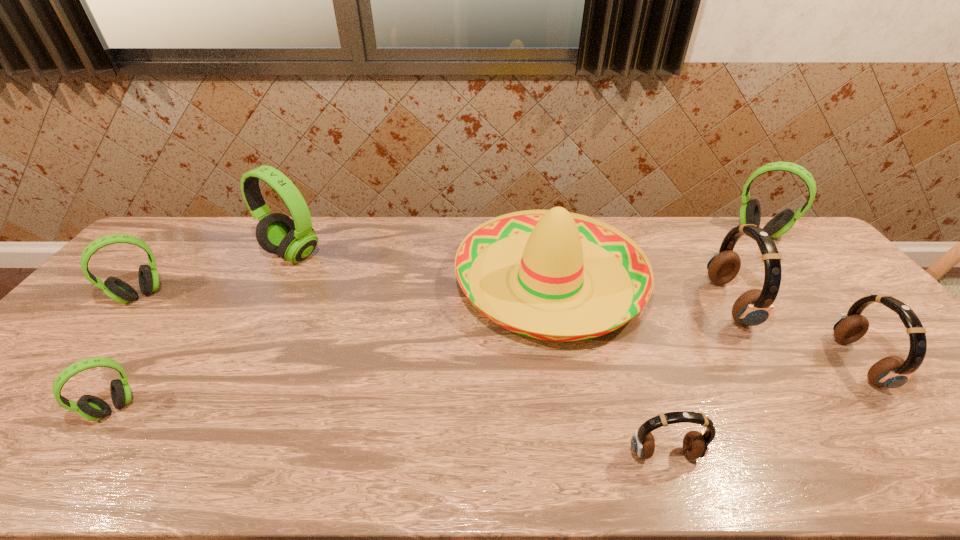
You are a GUI agent. You are given a task and a screenshot of the screen. Output one action in this format:
    pyautogui.click(x=<x>, y=<y>)
    Task: Click on the third green headset from left to right
    The height and width of the screenshot is (540, 960).
    Given the screenshot: What is the action you would take?
    [294, 240]

At what (x,y) coordinates should I click in order to perform the action: click on the third headset from left to right. Please return your answer as a coordinate pair (x, y). This screenshot has width=960, height=540. Looking at the image, I should click on (294, 240).

At what (x,y) coordinates should I click in order to perform the action: click on red sombrero. Please return your answer as a coordinate pair (x, y). This screenshot has width=960, height=540. Looking at the image, I should click on (555, 247).

Locate an element on the screen. This screenshot has width=960, height=540. the second biggest green headset is located at coordinates (750, 212).

Where is `the third object from right to left`? the third object from right to left is located at coordinates (754, 307).

Locate an element on the screen. the fifth headset from left to right is located at coordinates (754, 307).

Where is `the leftmost headset`? This screenshot has height=540, width=960. the leftmost headset is located at coordinates (118, 290).

Where is `the third farthest green headset`? This screenshot has height=540, width=960. the third farthest green headset is located at coordinates (118, 290).

Locate an element on the screen. This screenshot has height=540, width=960. the rightmost brown headset is located at coordinates (890, 372).

Identify the location of the nearest green headset. Image resolution: width=960 pixels, height=540 pixels. (90, 407).